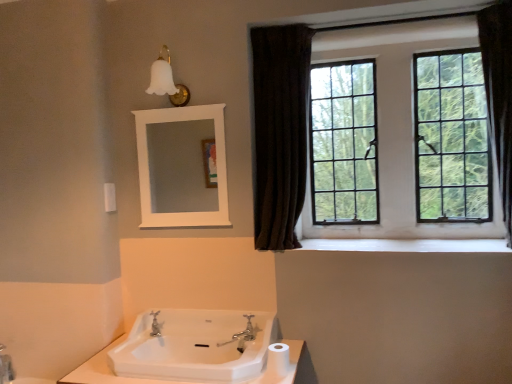
Identify the location of free point in front of silver metallic faucet at center. The image size is (512, 384). (254, 353).